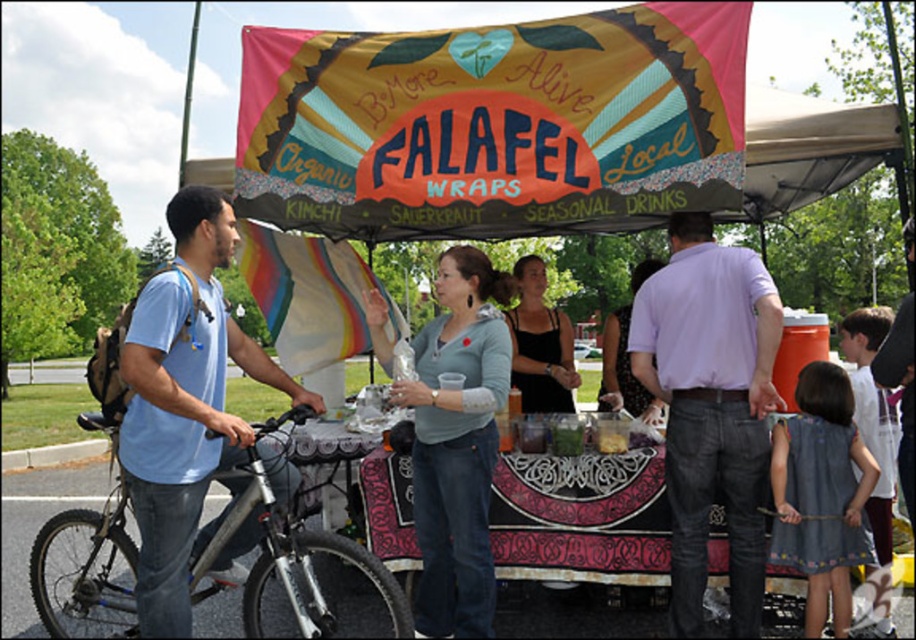
Can you confirm if blue t-shirt at left is positioned below silver metallic bicycle at left?

Actually, blue t-shirt at left is above silver metallic bicycle at left.

Does blue t-shirt at left have a greater width compared to silver metallic bicycle at left?

No.

Between point (167, 436) and point (249, 506), which one is positioned behind?

The point (249, 506) is more distant.

Image resolution: width=916 pixels, height=640 pixels. I want to click on blue t-shirt at left, so click(184, 406).

Does blue t-shirt at left come behind light blue sweater at center?

No, blue t-shirt at left is closer to the viewer.

Between point (184, 422) and point (469, 321), which one is positioned behind?

The point (469, 321) is more distant.

At what (x,y) coordinates should I click in order to perform the action: click on blue t-shirt at left. Please return your answer as a coordinate pair (x, y). Image resolution: width=916 pixels, height=640 pixels. Looking at the image, I should click on (184, 406).

Locate an element on the screen. The image size is (916, 640). blue t-shirt at left is located at coordinates (184, 406).

Is light blue sweater at center bigger than black tank top at center?

Yes.

Is point (474, 433) behind point (520, 282)?

No, it is in front of (520, 282).

Between point (477, 412) and point (516, 346), which one is positioned behind?

Point (516, 346)

You are a GUI agent. You are given a task and a screenshot of the screen. Output one action in this format:
    pyautogui.click(x=<x>, y=<y>)
    Task: Click on the light blue sweater at center
    
    Given the screenshot: What is the action you would take?
    pyautogui.click(x=458, y=444)